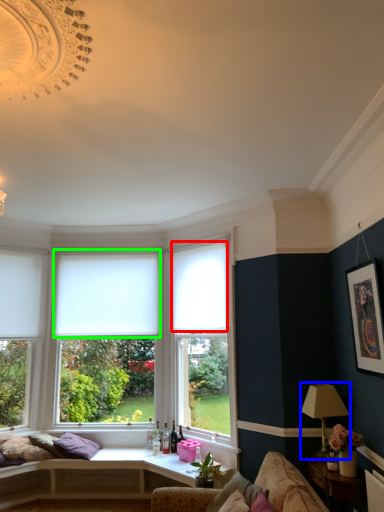
Question: Which is nearer to the curtain (highlighted by a red box)? lamp (highlighted by a blue box) or blind (highlighted by a green box).

Choices:
 (A) lamp
 (B) blind

Answer: (B)